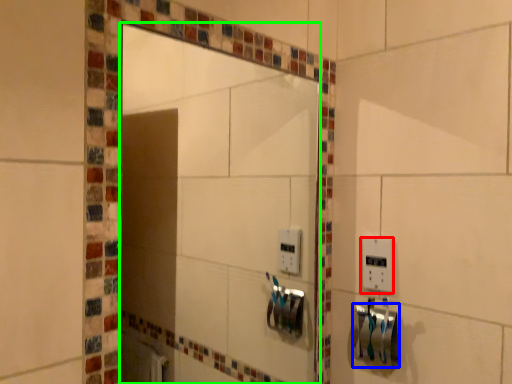
Question: Considering the real-world distances, which object is farthest from light switch (highlighted by a red box)? towel bar (highlighted by a blue box) or mirror (highlighted by a green box)?

Choices:
 (A) towel bar
 (B) mirror

Answer: (B)